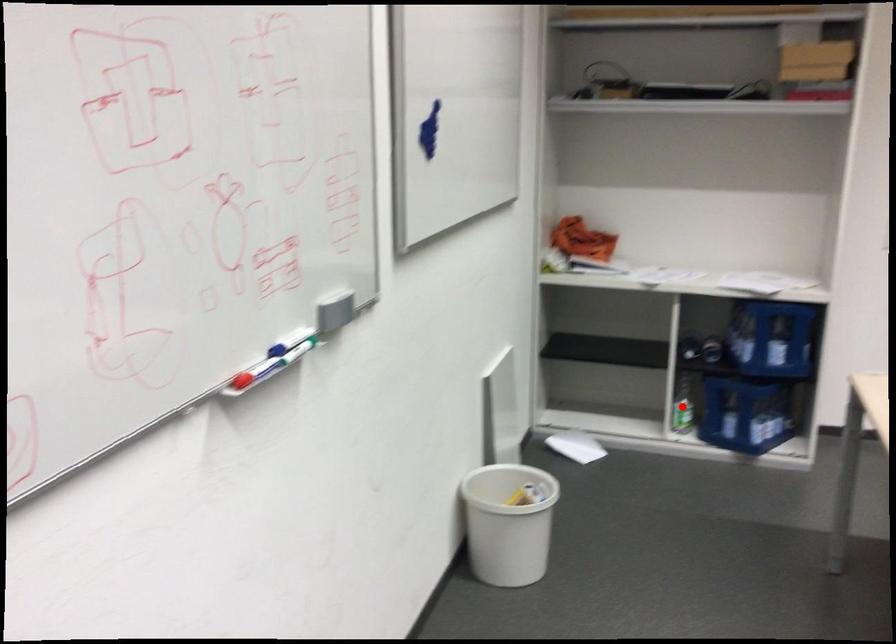
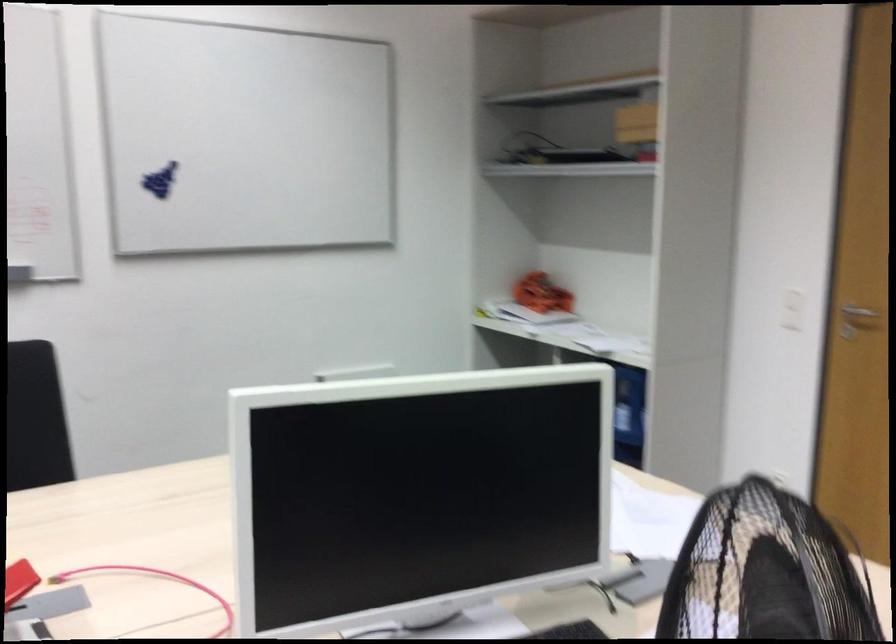
Question: I am providing you with two images of the same scene from different viewpoints. A red point is marked on the first image. Can you still see the location of the red point in image 2?

Choices:
 (A) Yes
 (B) No

Answer: (B)